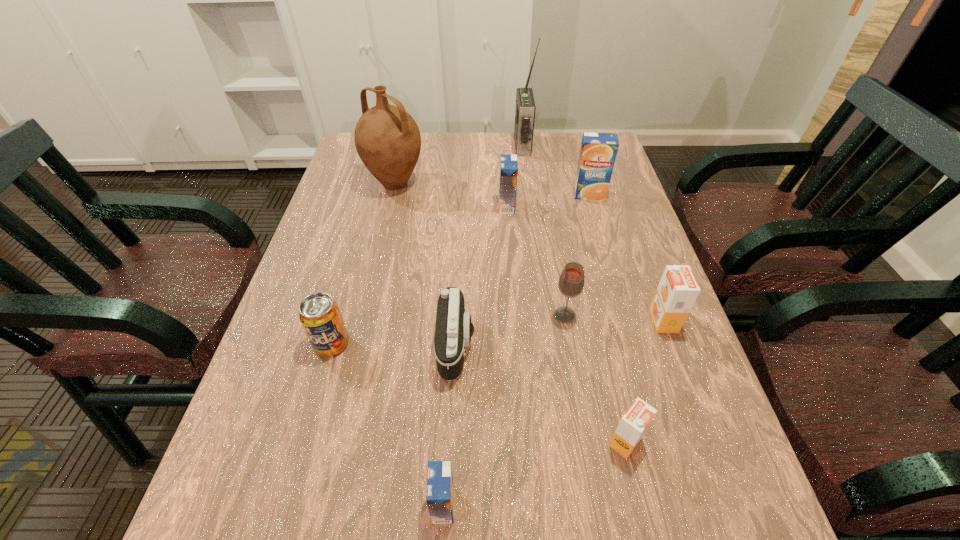
Where is `vacant area that lies between the nearer orange orange juice and the glass drink container`? vacant area that lies between the nearer orange orange juice and the glass drink container is located at coordinates (595, 379).

Where is `vacant space that's between the pitcher and the farthest object`? vacant space that's between the pitcher and the farthest object is located at coordinates (459, 165).

The image size is (960, 540). I want to click on free point between the bigger orange orange juice and the smallest blue orange_juice, so click(553, 413).

Identify the location of free space that is in between the glass drink container and the camera. This screenshot has width=960, height=540. (511, 330).

Locate an element on the screen. vacant space that's between the right orange orange juice and the pitcher is located at coordinates (529, 252).

Where is `empty location between the ninth shortest object and the rightmost blue orange_juice`? The height and width of the screenshot is (540, 960). empty location between the ninth shortest object and the rightmost blue orange_juice is located at coordinates (492, 189).

At what (x,y) coordinates should I click in order to perform the action: click on vacant area that lies between the glass drink container and the third farthest orange_juice. Please return your answer as a coordinate pair (x, y). The image size is (960, 540). Looking at the image, I should click on (614, 318).

Locate which object ranks seventh in proximity to the second blue orange_juice from left to right. Please provide its 2D coordinates. Your answer should be formatted as a tuple, i.e. [(x, y)], where the tuple contains the x and y coordinates of a point satisfying the conditions above.

[(319, 314)]

Image resolution: width=960 pixels, height=540 pixels. Identify the location of the seventh closest object to the radio receiver. pos(319,314).

Where is `the closest orange_juice to the rightmost blue orange_juice`? Image resolution: width=960 pixels, height=540 pixels. the closest orange_juice to the rightmost blue orange_juice is located at coordinates (508, 173).